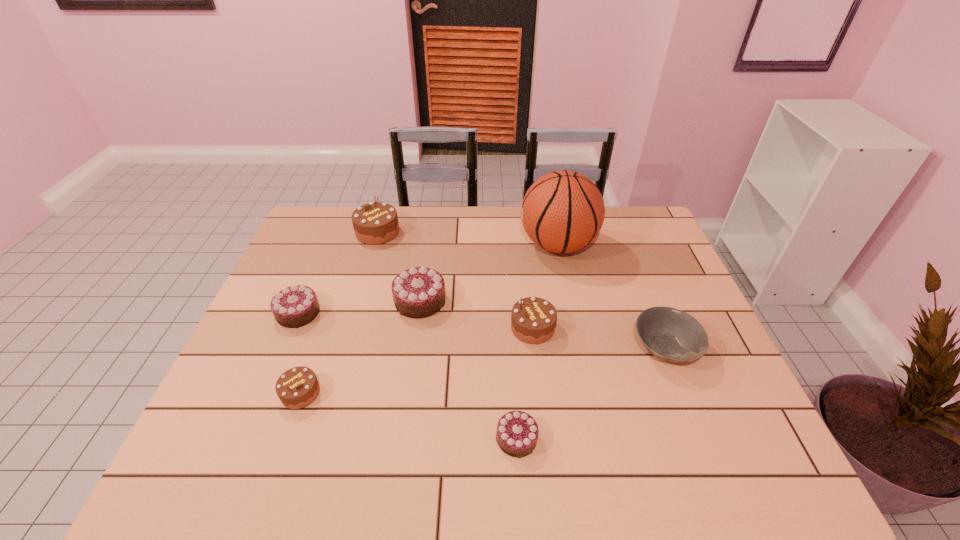
You are a GUI agent. You are given a task and a screenshot of the screen. Output one action in this format:
    pyautogui.click(x=<x>, y=<y>)
    Task: Click on the free space located on the front of the second nearest brown chocolate cake
    
    Given the screenshot: What is the action you would take?
    pyautogui.click(x=538, y=367)

This screenshot has height=540, width=960. I want to click on vacant space positioned 0.200m on the right of the leftmost chocolate chocolate cake, so click(x=391, y=313).

Image resolution: width=960 pixels, height=540 pixels. In order to click on blank space located on the right of the seventh farthest object in this screenshot , I will do `click(417, 393)`.

Locate an element on the screen. vacant space located on the back of the gray bowl is located at coordinates (643, 293).

Locate an element on the screen. vacant space located on the back of the shortest object is located at coordinates (511, 349).

The image size is (960, 540). I want to click on basketball that is at the far edge, so click(x=563, y=211).

The image size is (960, 540). What are the coordinates of `chocolate cake at the far edge` in the screenshot? It's located at (374, 223).

I want to click on object located in the near edge section of the desktop, so click(x=517, y=432).

Where is `object that is at the right edge`? object that is at the right edge is located at coordinates (670, 334).

Identify the location of free space at the far edge of the desktop. The image size is (960, 540). coord(609,241).